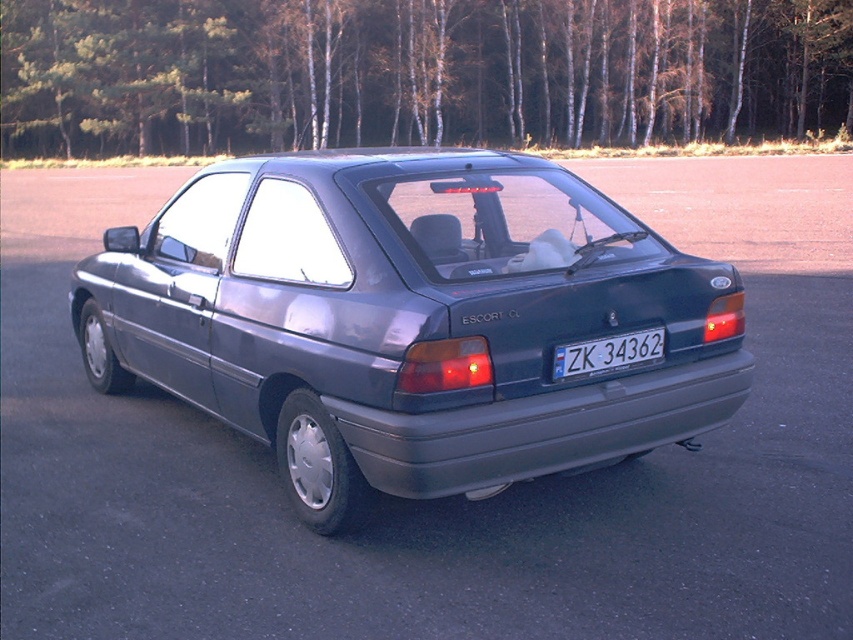
You are a parking attendant who needs to ensure vehicles are parked properly. You observe the satin metallic car at center and the white plastic license plate at center. Based on their positioning, can you determine if the car is correctly aligned with the parking space markers?

The satin metallic car at center is positioned over the white plastic license plate at center, which suggests that the car is correctly aligned with the parking space markers since the license plate is typically centered when properly parked.